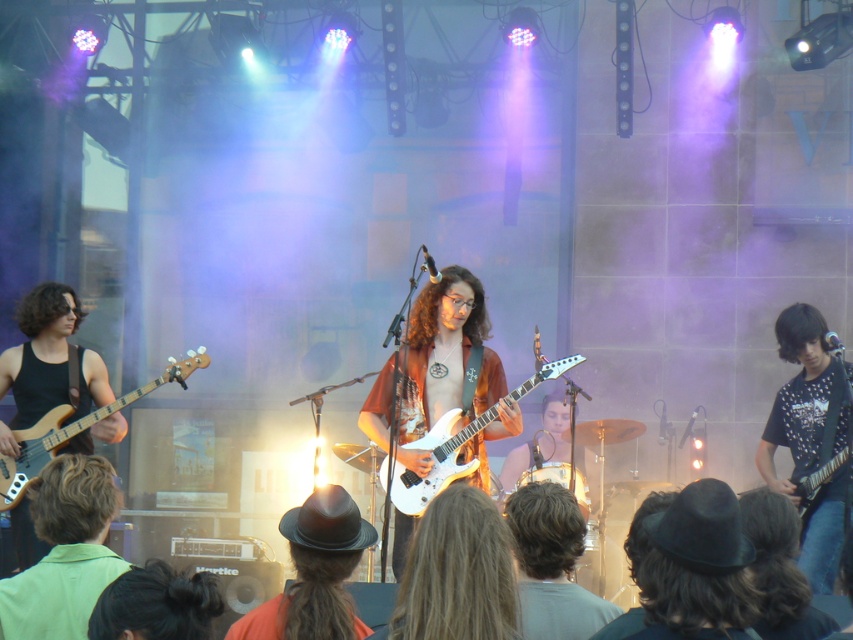
Is blonde hair at center positioned in front of white glossy electric guitar at center?

That is True.

Consider the image. Can you confirm if blonde hair at center is bigger than white glossy electric guitar at center?

Actually, blonde hair at center might be smaller than white glossy electric guitar at center.

Measure the distance between blonde hair at center and camera.

They are 2.70 meters apart.

Find the location of a particular element. This screenshot has width=853, height=640. blonde hair at center is located at coordinates (552, 564).

From the picture: Can you confirm if long brown hair at center is smaller than matte black bass at left?

Correct, long brown hair at center occupies less space than matte black bass at left.

Is point (444, 602) farther from camera compared to point (22, 486)?

No.

The width and height of the screenshot is (853, 640). Find the location of `long brown hair at center`. long brown hair at center is located at coordinates (457, 573).

Where is `long brown hair at center`? The image size is (853, 640). long brown hair at center is located at coordinates (457, 573).

Is point (107, 554) positioned in front of point (254, 616)?

That is False.

Is green fabric shirt at lower left wider than black felt hat at center?

No, green fabric shirt at lower left is not wider than black felt hat at center.

Which is behind, point (62, 460) or point (276, 612)?

Point (62, 460)

You are a GUI agent. You are given a task and a screenshot of the screen. Output one action in this format:
    pyautogui.click(x=<x>, y=<y>)
    Task: Click on the green fabric shirt at lower left
    
    Given the screenshot: What is the action you would take?
    pyautogui.click(x=64, y=552)